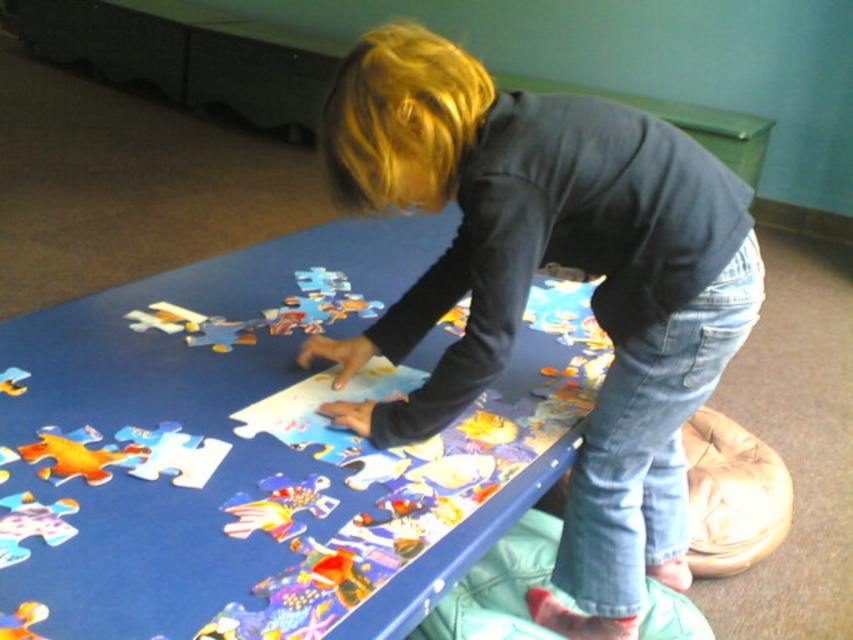
Question: Does blue cardboard puzzle board at center have a greater width compared to matte black shirt at center?

Choices:
 (A) no
 (B) yes

Answer: (B)

Question: Is blue cardboard puzzle board at center to the left of matte black shirt at center from the viewer's perspective?

Choices:
 (A) yes
 (B) no

Answer: (A)

Question: Does blue cardboard puzzle board at center have a lesser width compared to matte black shirt at center?

Choices:
 (A) no
 (B) yes

Answer: (A)

Question: Which object is closer to the camera taking this photo?

Choices:
 (A) blue cardboard puzzle board at center
 (B) matte black shirt at center

Answer: (A)